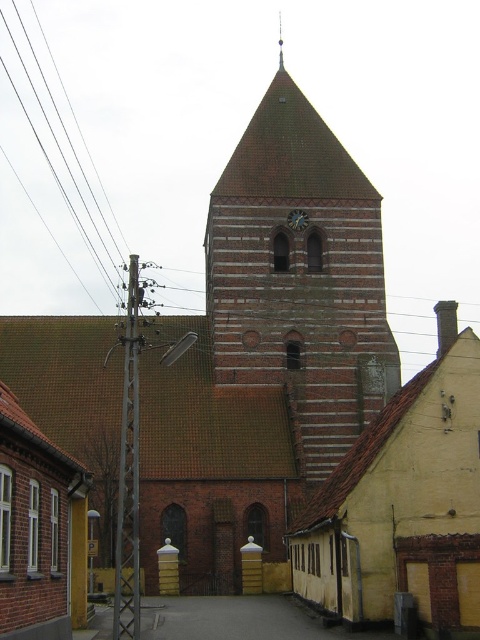
Between brown brick tower at center and matte brown clock at center, which one has less height?

With less height is matte brown clock at center.

Does point (297, 384) come in front of point (300, 221)?

Yes, point (297, 384) is in front of point (300, 221).

Between point (393, 349) and point (291, 228), which one is positioned in front?

Point (393, 349)

Find the location of a particular element. Image resolution: width=480 pixels, height=640 pixels. brown brick tower at center is located at coordinates (300, 276).

Can you confirm if brown brick tower at center is positioned to the left of metallic gray pole at left?

No, brown brick tower at center is not to the left of metallic gray pole at left.

Does point (305, 294) come farther from viewer compared to point (136, 285)?

Yes.

The image size is (480, 640). I want to click on brown brick tower at center, so click(300, 276).

Between metallic gray pole at left and matte brown clock at center, which one appears on the right side from the viewer's perspective?

Positioned to the right is matte brown clock at center.

Which is in front, point (137, 307) or point (290, 212)?

Point (137, 307) is more forward.

Who is more forward, (127, 484) or (304, 227)?

Point (127, 484) is more forward.

Identify the location of metallic gray pole at left. (129, 474).